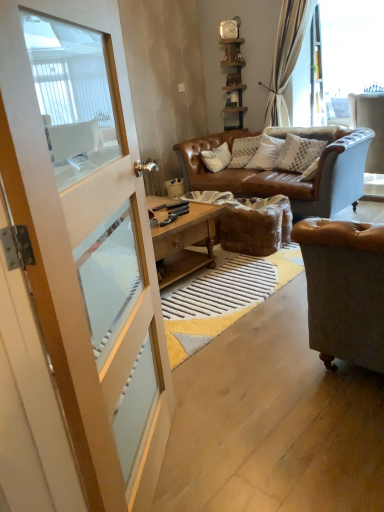
Question: Is metallic wall clock at upper center outside white wood screen door at left?

Choices:
 (A) yes
 (B) no

Answer: (A)

Question: Can you confirm if metallic wall clock at upper center is taller than white wood screen door at left?

Choices:
 (A) yes
 (B) no

Answer: (B)

Question: Is metallic wall clock at upper center far away from white wood screen door at left?

Choices:
 (A) yes
 (B) no

Answer: (A)

Question: Is metallic wall clock at upper center looking in the opposite direction of white wood screen door at left?

Choices:
 (A) no
 (B) yes

Answer: (A)

Question: Is metallic wall clock at upper center oriented towards white wood screen door at left?

Choices:
 (A) no
 (B) yes

Answer: (B)

Question: From the image's perspective, relative to metallic wall clock at upper center, is brown leather footrest at center above or below?

Choices:
 (A) below
 (B) above

Answer: (A)

Question: Considering the positions of brown leather footrest at center and metallic wall clock at upper center in the image, is brown leather footrest at center taller or shorter than metallic wall clock at upper center?

Choices:
 (A) short
 (B) tall

Answer: (B)

Question: Considering their positions, is brown leather footrest at center located in front of or behind metallic wall clock at upper center?

Choices:
 (A) front
 (B) behind

Answer: (A)

Question: From a real-world perspective, is brown leather footrest at center positioned above or below metallic wall clock at upper center?

Choices:
 (A) below
 (B) above

Answer: (A)

Question: Based on their sizes in the image, would you say brown leather footrest at center is bigger or smaller than white textured pillow at center?

Choices:
 (A) big
 (B) small

Answer: (A)

Question: From a real-world perspective, is brown leather footrest at center above or below white textured pillow at center?

Choices:
 (A) below
 (B) above

Answer: (A)

Question: Is brown leather footrest at center spatially inside white textured pillow at center, or outside of it?

Choices:
 (A) outside
 (B) inside

Answer: (A)

Question: In terms of width, does brown leather footrest at center look wider or thinner when compared to white textured pillow at center?

Choices:
 (A) wide
 (B) thin

Answer: (A)

Question: In terms of height, does metallic wall clock at upper center look taller or shorter compared to white textured pillow at center?

Choices:
 (A) tall
 (B) short

Answer: (B)

Question: Is metallic wall clock at upper center in front of or behind white textured pillow at center in the image?

Choices:
 (A) front
 (B) behind

Answer: (B)